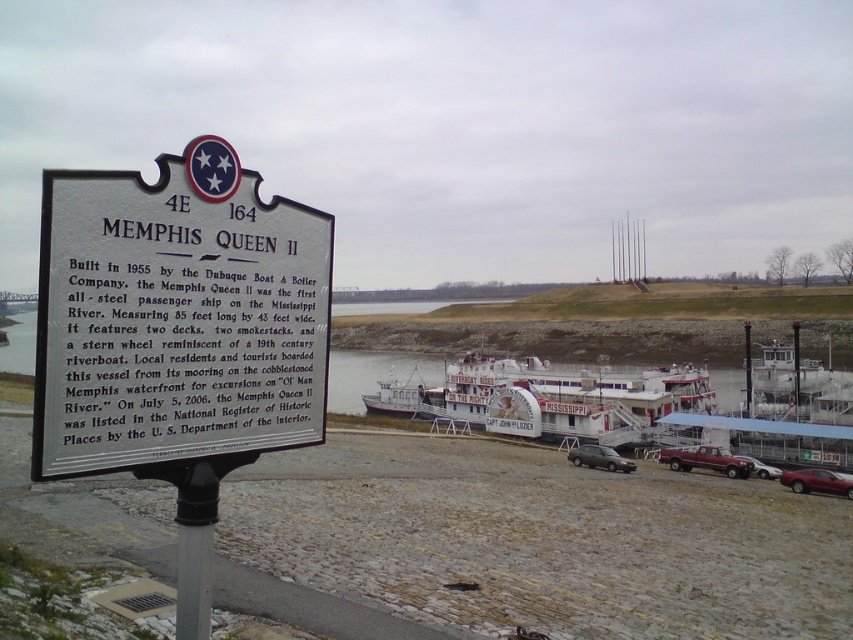
Question: Is silver metallic sign at center wider than white painted wood boat at center?

Choices:
 (A) yes
 (B) no

Answer: (B)

Question: Which object is farther from the camera taking this photo?

Choices:
 (A) metallic gray sedan at center
 (B) white painted wood boat at center
 (C) shiny red sedan at lower right
 (D) metallic maroon pickup truck at lower right

Answer: (B)

Question: Which is farther from the metallic gray sedan at center?

Choices:
 (A) metallic maroon pickup truck at lower right
 (B) silver metallic sign at center
 (C) white painted wood boat at center

Answer: (B)

Question: Observing the image, what is the correct spatial positioning of shiny red sedan at lower right in reference to metallic gray sedan at center?

Choices:
 (A) right
 (B) left

Answer: (A)

Question: Which of these objects is positioned closest to the white painted wood boat at center?

Choices:
 (A) metallic gray sedan at center
 (B) metallic maroon pickup truck at lower right
 (C) metallic silver car at lower right

Answer: (A)

Question: Can you confirm if silver metallic sign at center is positioned above metallic silver car at lower right?

Choices:
 (A) yes
 (B) no

Answer: (A)